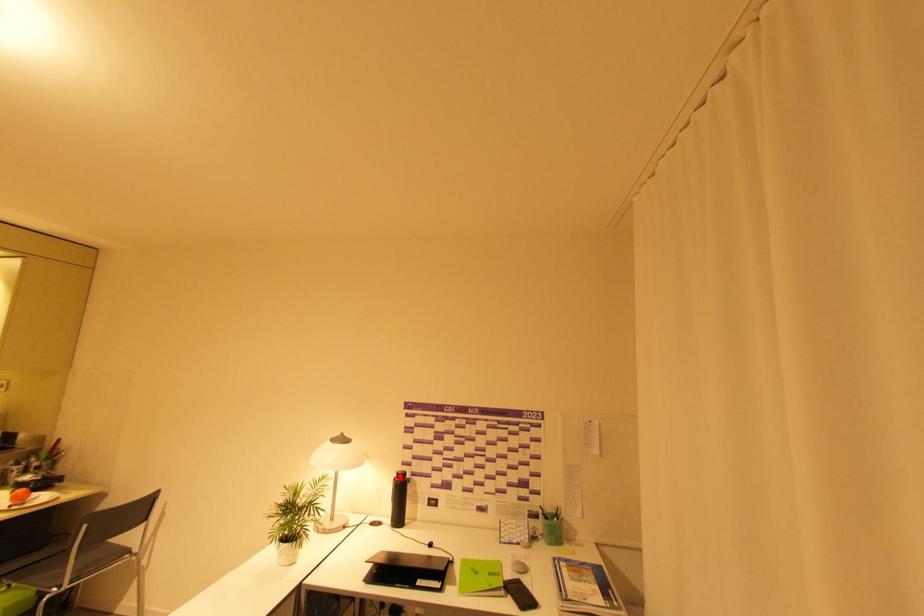
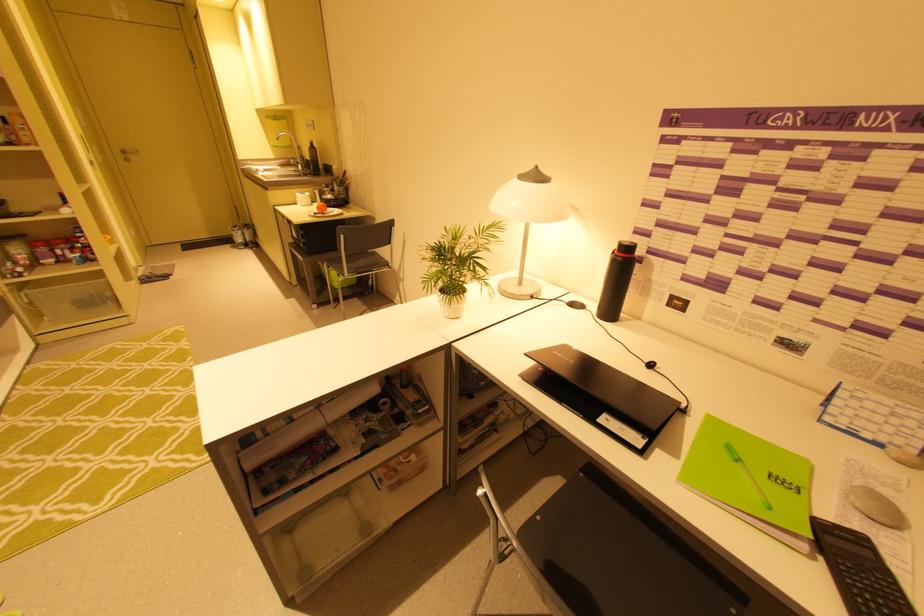
The point at the highlighted location is marked in the first image. Where is the corresponding point in the second image?

(619, 248)